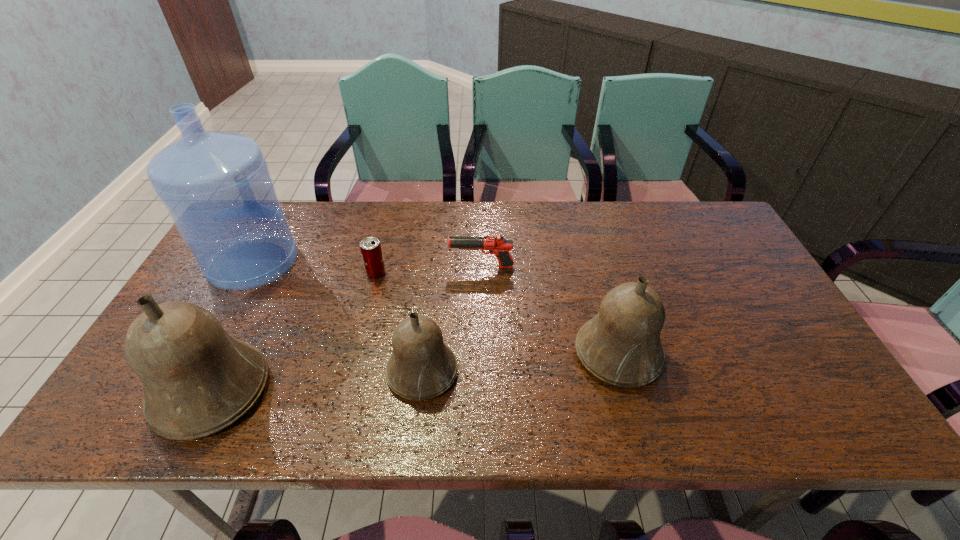
You are a GUI agent. You are given a task and a screenshot of the screen. Output one action in this format:
    pyautogui.click(x=<x>, y=<y>)
    Task: Click on the bell located at the left edge
    This screenshot has width=960, height=540.
    Given the screenshot: What is the action you would take?
    pyautogui.click(x=198, y=379)

Locate an element on the screen. This screenshot has width=960, height=540. water jug at the left edge is located at coordinates (216, 186).

The image size is (960, 540). I want to click on object situated at the far left corner, so click(x=216, y=186).

The width and height of the screenshot is (960, 540). I want to click on object at the near left corner, so click(x=198, y=379).

You are a GUI agent. You are given a task and a screenshot of the screen. Output one action in this format:
    pyautogui.click(x=<x>, y=<y>)
    Task: Click on the vacant space at the far edge of the desktop
    
    Given the screenshot: What is the action you would take?
    pyautogui.click(x=295, y=227)

Where is `free location at the left edge`? free location at the left edge is located at coordinates (x=219, y=320).

You are a GUI agent. You are given a task and a screenshot of the screen. Output one action in this format:
    pyautogui.click(x=<x>, y=<y>)
    Task: Click on the vacant area at the right edge
    This screenshot has width=960, height=540.
    Given the screenshot: What is the action you would take?
    pyautogui.click(x=742, y=309)

This screenshot has height=540, width=960. In order to click on free space between the second shortest bell and the gun in this screenshot , I will do `click(550, 310)`.

Where is `vacant space that's between the beer can and the fourth tallest object`? vacant space that's between the beer can and the fourth tallest object is located at coordinates (399, 322).

Image resolution: width=960 pixels, height=540 pixels. What are the coordinates of `vacant space that's between the water jug and the shortest bell` in the screenshot? It's located at (338, 317).